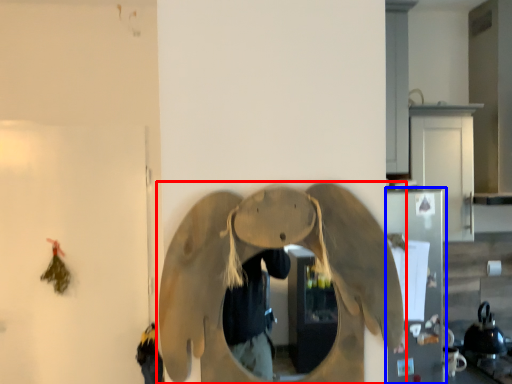
Question: Which object appears closest to the camera in this image, elephant (highlighted by a red box) or appliance (highlighted by a blue box)?

Choices:
 (A) elephant
 (B) appliance

Answer: (A)